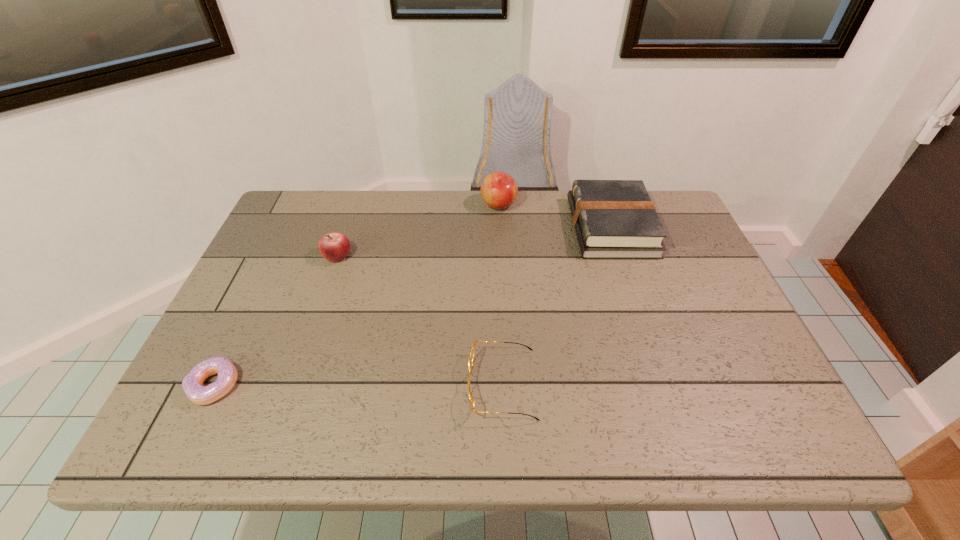
Where is `vacant space at the near right corner of the desktop`? The image size is (960, 540). vacant space at the near right corner of the desktop is located at coordinates (795, 433).

Where is `unoccupied position between the rightmost object and the tallest object`? unoccupied position between the rightmost object and the tallest object is located at coordinates (555, 216).

At what (x,y) coordinates should I click in order to perform the action: click on free spot between the taller apple and the hardback book. Please return your answer as a coordinate pair (x, y). The image size is (960, 540). Looking at the image, I should click on click(555, 216).

This screenshot has height=540, width=960. I want to click on free area in between the taller apple and the hardback book, so click(555, 216).

You are a GUI agent. You are given a task and a screenshot of the screen. Output one action in this format:
    pyautogui.click(x=<x>, y=<y>)
    Task: Click on the unoccupied area between the leftmost object and the fourth tallest object
    
    Given the screenshot: What is the action you would take?
    pyautogui.click(x=358, y=385)

I want to click on free space between the doughnut and the taller apple, so click(356, 295).

Identify the location of empty space that is in between the fourth tallest object and the left apple. click(420, 320).

This screenshot has width=960, height=540. Identify the location of unoccupied position between the second shortest object and the farther apple. (500, 295).

Identify the location of vacant space that's between the right apple and the doughnut. (356, 295).

The image size is (960, 540). Find the location of `empty space between the doughnut and the left apple`. empty space between the doughnut and the left apple is located at coordinates (276, 320).